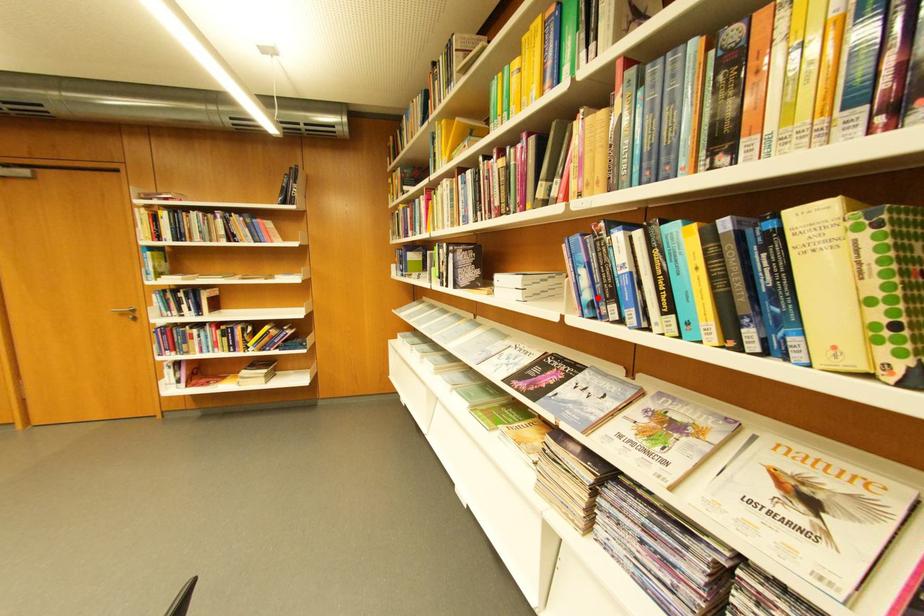
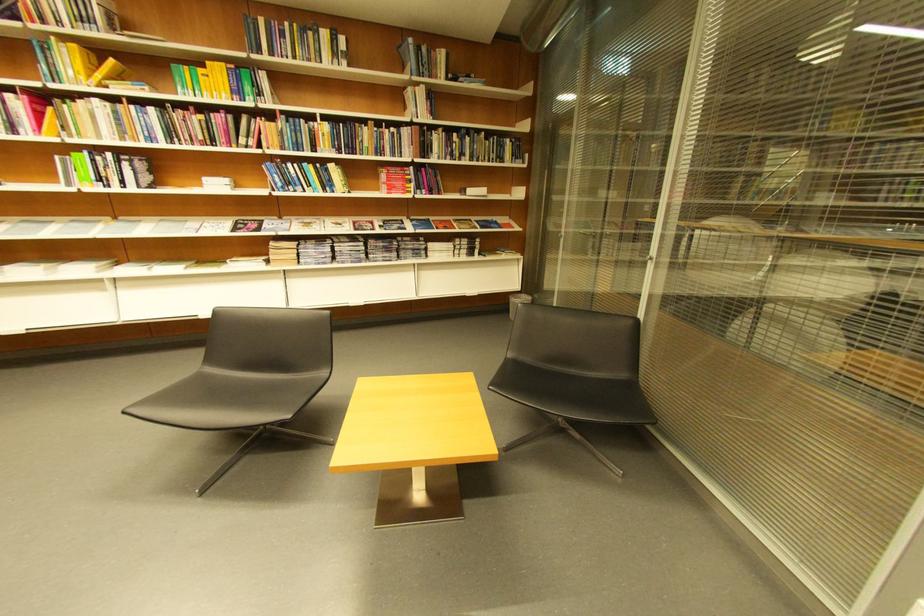
The point at the highlighted location is marked in the first image. Where is the corresponding point in the second image?

(290, 185)